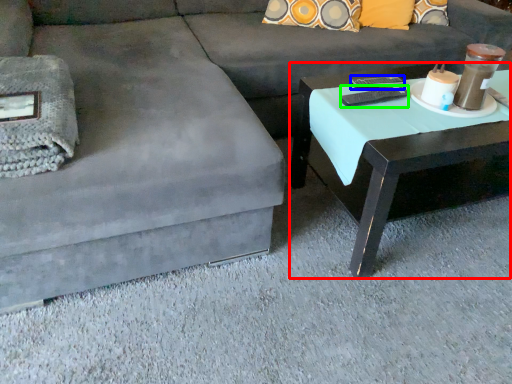
Question: Estimate the real-world distances between objects in this image. Which object is closer to coffee table (highlighted by a red box), remote (highlighted by a blue box) or remote (highlighted by a green box)?

Choices:
 (A) remote
 (B) remote

Answer: (B)